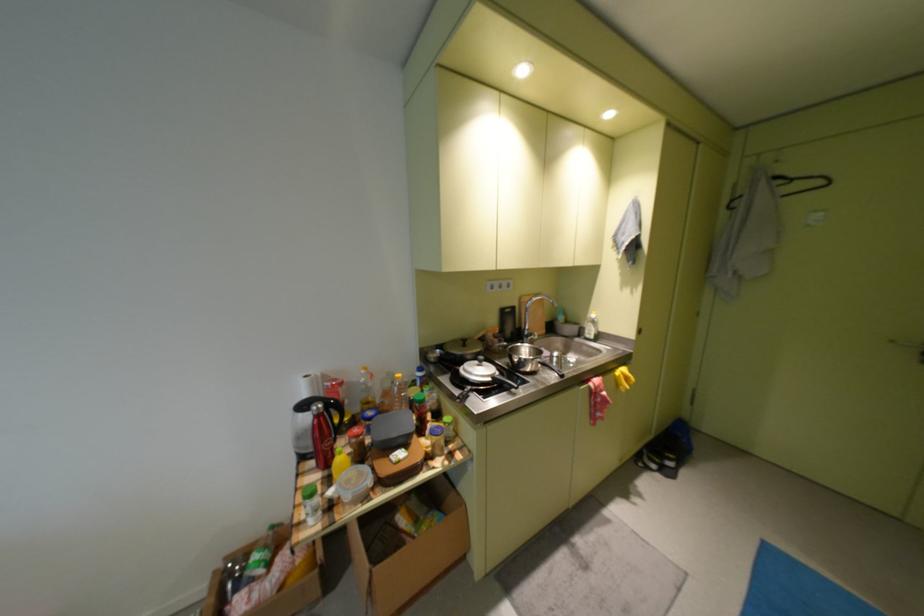
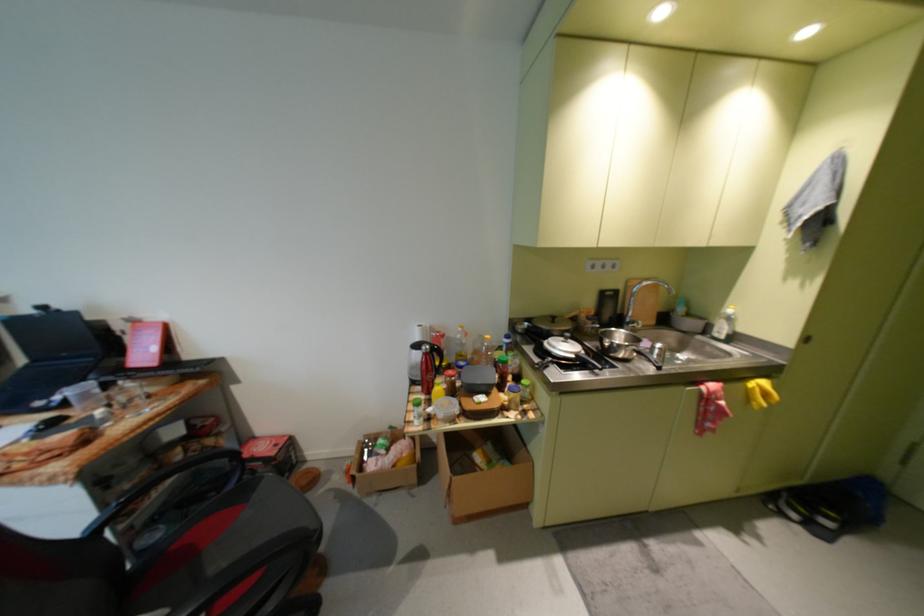
In the second image, find the point that corresponds to pixel 601 334 in the first image.

(732, 331)